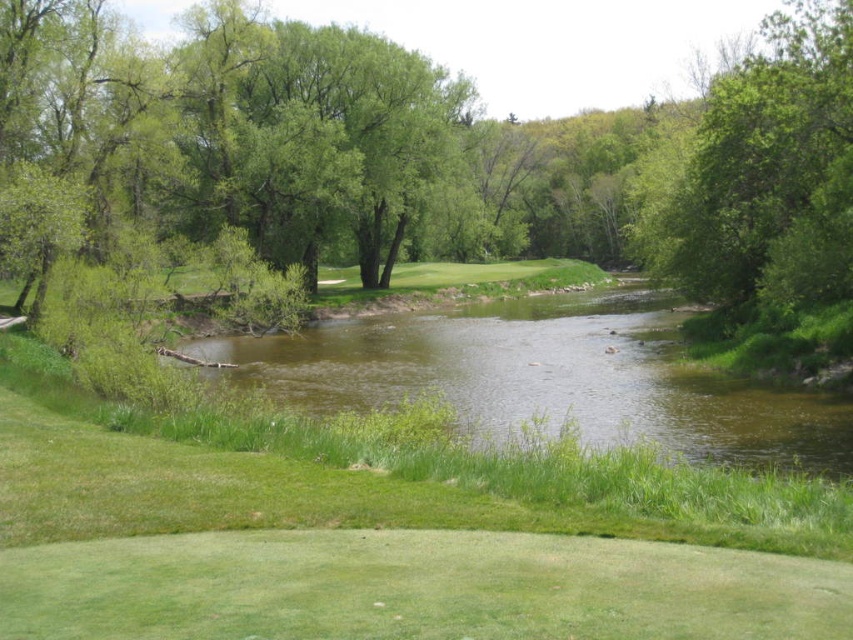
Measure the distance from green grassy golf course at center to green leafy tree at upper right.

green grassy golf course at center and green leafy tree at upper right are 21.20 meters apart from each other.

Does point (376, 612) come farther from viewer compared to point (688, 236)?

No, it is not.

This screenshot has width=853, height=640. In order to click on green grassy golf course at center in this screenshot , I will do `click(387, 536)`.